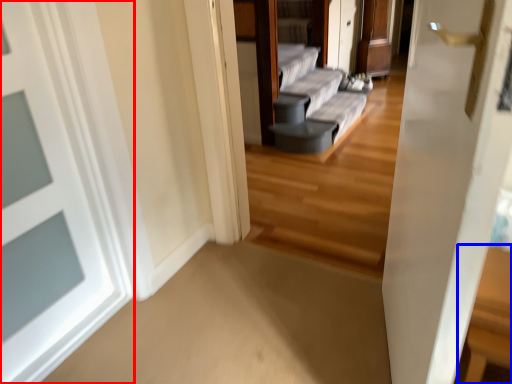
Question: Among these objects, which one is nearest to the camera, door (highlighted by a red box) or table (highlighted by a blue box)?

Choices:
 (A) door
 (B) table

Answer: (A)